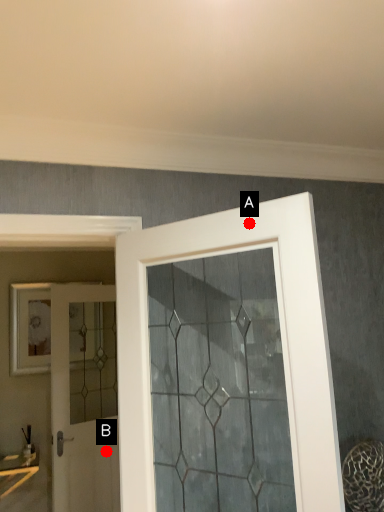
Question: Two points are circled on the image, labeled by A and B beside each circle. Which point appears farthest from the camera in this image?

Choices:
 (A) A is further
 (B) B is further

Answer: (B)